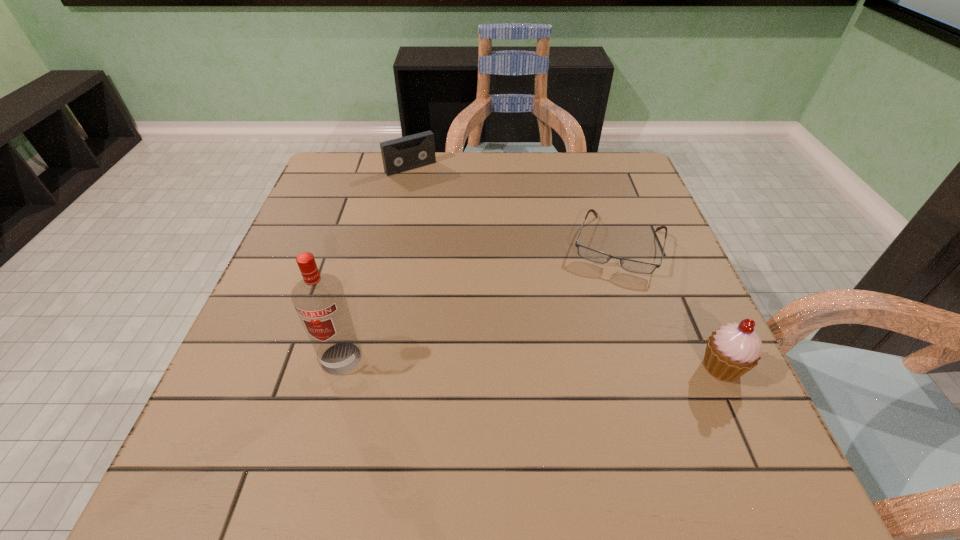
Locate an element on the screen. vacant point at the far edge is located at coordinates (422, 167).

The width and height of the screenshot is (960, 540). Identify the location of blank space at the near edge of the desktop. [416, 395].

In order to click on vacant space at the left edge in this screenshot , I will do click(x=260, y=362).

Where is `free space at the far left corner of the desktop`? free space at the far left corner of the desktop is located at coordinates (352, 161).

In the image, there is a desktop. At what (x,y) coordinates should I click in order to perform the action: click on free space at the far right corner. Please return your answer as a coordinate pair (x, y). The width and height of the screenshot is (960, 540). Looking at the image, I should click on (606, 158).

In the image, there is a desktop. Where is `free space at the near right corner`? free space at the near right corner is located at coordinates (665, 399).

Locate an element on the screen. vacant area that lies between the cupcake and the shortest object is located at coordinates (669, 306).

Locate an element on the screen. The height and width of the screenshot is (540, 960). free space that is in between the farthest object and the shortest object is located at coordinates (514, 206).

Locate an element on the screen. The height and width of the screenshot is (540, 960). free spot between the tallest object and the farthest object is located at coordinates (376, 262).

The height and width of the screenshot is (540, 960). What are the coordinates of `free point between the farthest object and the tallest object` in the screenshot? It's located at (376, 262).